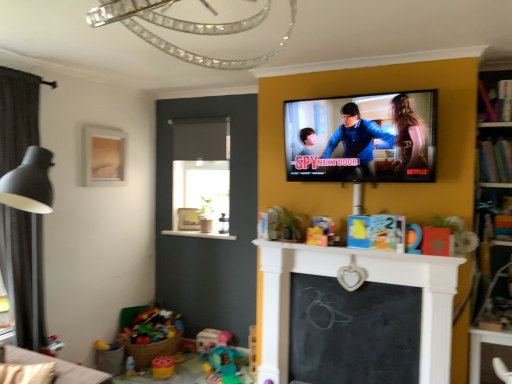
Question: From the image's perspective, is plastic toy at lower left under wooden bookshelf at upper right, the first shelf in the bottom-to-top sequence?

Choices:
 (A) yes
 (B) no

Answer: (A)

Question: Considering the relative sizes of plastic toy at lower left and wooden bookshelf at upper right, the first shelf in the bottom-to-top sequence, in the image provided, is plastic toy at lower left thinner than wooden bookshelf at upper right, the first shelf in the bottom-to-top sequence,?

Choices:
 (A) no
 (B) yes

Answer: (A)

Question: Is plastic toy at lower left to the left of wooden bookshelf at upper right, the first shelf in the bottom-to-top sequence, from the viewer's perspective?

Choices:
 (A) yes
 (B) no

Answer: (A)

Question: Does plastic toy at lower left have a greater height compared to wooden bookshelf at upper right, arranged as the 2th shelf when viewed from the top?

Choices:
 (A) yes
 (B) no

Answer: (B)

Question: Can you confirm if plastic toy at lower left is wider than wooden bookshelf at upper right, arranged as the 2th shelf when viewed from the top?

Choices:
 (A) yes
 (B) no

Answer: (A)

Question: From a real-world perspective, does plastic toy at lower left stand above wooden bookshelf at upper right, arranged as the 2th shelf when viewed from the top?

Choices:
 (A) yes
 (B) no

Answer: (B)

Question: Is matte orange toy at center, the fourth toy viewed from the left, bigger than translucent plastic cup at lower left, acting as the fourth toy starting from the top?

Choices:
 (A) no
 (B) yes

Answer: (A)

Question: Is translucent plastic cup at lower left, the 2th toy in the front-to-back sequence, located within matte orange toy at center, the first toy in the front-to-back sequence?

Choices:
 (A) no
 (B) yes

Answer: (A)

Question: Is matte orange toy at center, the first toy in the front-to-back sequence, positioned with its back to translucent plastic cup at lower left, which is the first toy from bottom to top?

Choices:
 (A) yes
 (B) no

Answer: (B)

Question: From a real-world perspective, is matte orange toy at center, marked as the 4th toy in a back-to-front arrangement, on translucent plastic cup at lower left, the 2th toy in the front-to-back sequence?

Choices:
 (A) no
 (B) yes

Answer: (B)

Question: From the image's perspective, does matte orange toy at center, acting as the 1th toy starting from the top, appear lower than translucent plastic cup at lower left, which is counted as the third toy, starting from the back?

Choices:
 (A) yes
 (B) no

Answer: (B)

Question: Is matte orange toy at center, acting as the 1th toy starting from the top, facing towards translucent plastic cup at lower left, which is the first toy from bottom to top?

Choices:
 (A) yes
 (B) no

Answer: (B)

Question: Can you confirm if bright multicolored plastic toys at lower left, the 3th toy viewed from the right, is positioned to the left of wooden bookshelf at upper right, arranged as the 2th shelf when viewed from the top?

Choices:
 (A) yes
 (B) no

Answer: (A)